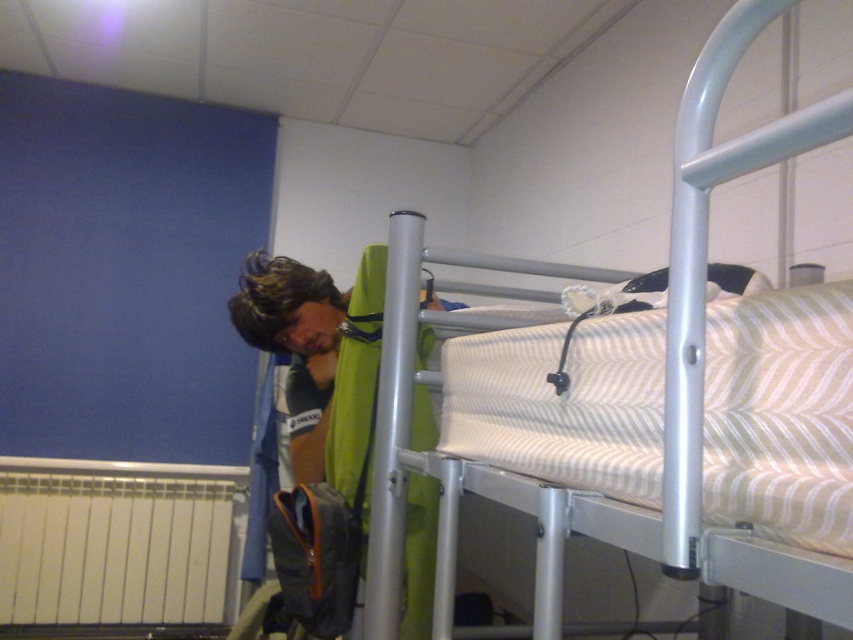
Question: Can you confirm if metallic silver bunk bed at upper right is smaller than green fabric at center?

Choices:
 (A) no
 (B) yes

Answer: (A)

Question: Which of the following is the closest to the observer?

Choices:
 (A) (541, 573)
 (B) (317, 300)

Answer: (A)

Question: Among these points, which one is farthest from the camera?

Choices:
 (A) (514, 490)
 (B) (270, 266)

Answer: (B)

Question: Is metallic silver bunk bed at upper right bigger than green fabric at center?

Choices:
 (A) yes
 (B) no

Answer: (A)

Question: Among these points, which one is nearest to the camera?

Choices:
 (A) (280, 317)
 (B) (386, 432)

Answer: (B)

Question: Does metallic silver bunk bed at upper right have a greater width compared to green fabric at center?

Choices:
 (A) yes
 (B) no

Answer: (B)